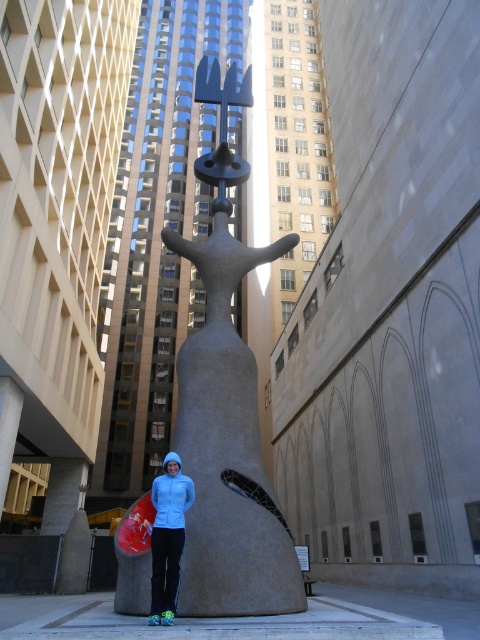
Question: Can you confirm if blue fleece jacket at center is positioned to the right of light blue fleece at center?

Choices:
 (A) no
 (B) yes

Answer: (B)

Question: Which point is closer to the camera?

Choices:
 (A) (152, 572)
 (B) (183, 572)
 (C) (158, 490)

Answer: (A)

Question: Among these objects, which one is farthest from the camera?

Choices:
 (A) blue fleece jacket at center
 (B) light blue fleece at center
 (C) smooth gray statue at center

Answer: (B)

Question: Which point appears closest to the camera in this image?

Choices:
 (A) (218, 186)
 (B) (177, 522)
 (C) (153, 586)

Answer: (C)

Question: From the image, what is the correct spatial relationship of blue fleece jacket at center in relation to light blue fleece at center?

Choices:
 (A) left
 (B) right

Answer: (B)

Question: Can you confirm if smooth gray statue at center is thinner than blue fleece jacket at center?

Choices:
 (A) yes
 (B) no

Answer: (B)